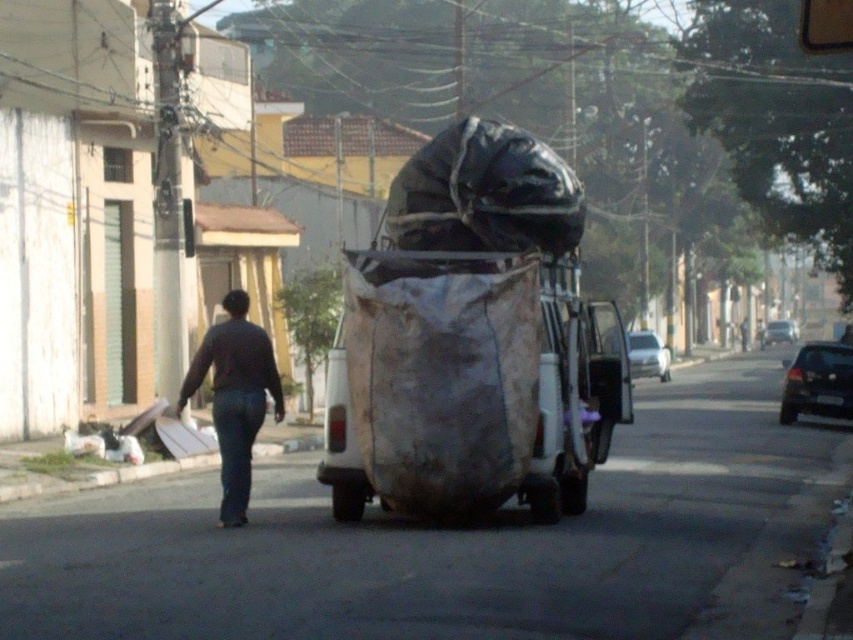
Question: Is dark blue jeans at center positioned in front of shiny black car at right?

Choices:
 (A) no
 (B) yes

Answer: (B)

Question: Among these objects, which one is farthest from the camera?

Choices:
 (A) shiny silver sedan at center
 (B) shiny black car at right

Answer: (A)

Question: Can you confirm if shiny black car at right is positioned below shiny silver sedan at center?

Choices:
 (A) no
 (B) yes

Answer: (B)

Question: Can you confirm if dark blue jeans at center is thinner than gray concrete curb at lower left?

Choices:
 (A) yes
 (B) no

Answer: (A)

Question: Which of the following is the farthest from the observer?

Choices:
 (A) shiny silver sedan at center
 (B) white glossy car at center
 (C) shiny black car at right
 (D) dark blue jeans at center

Answer: (A)

Question: Which of the following is the closest to the observer?

Choices:
 (A) (39, 496)
 (B) (804, 397)
 (C) (781, 333)

Answer: (A)